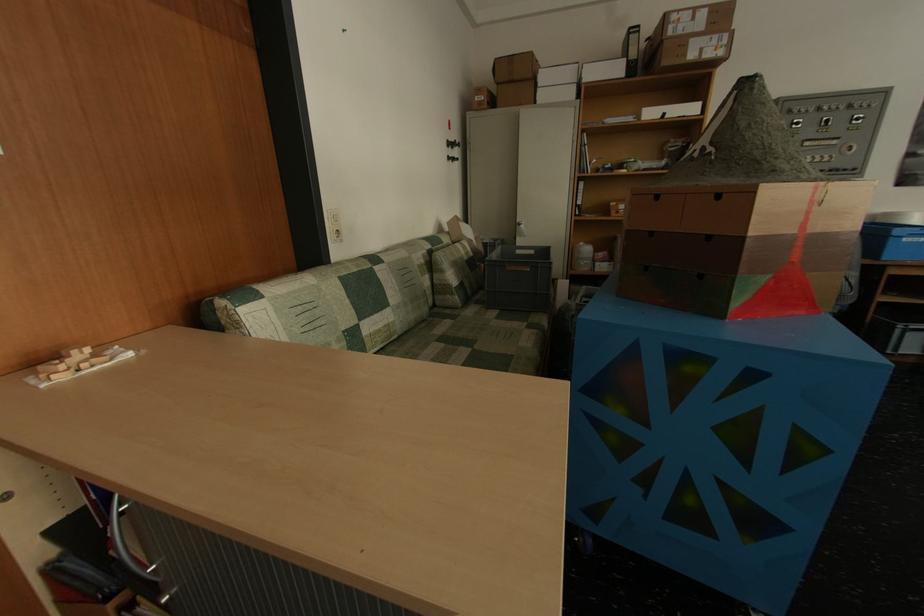
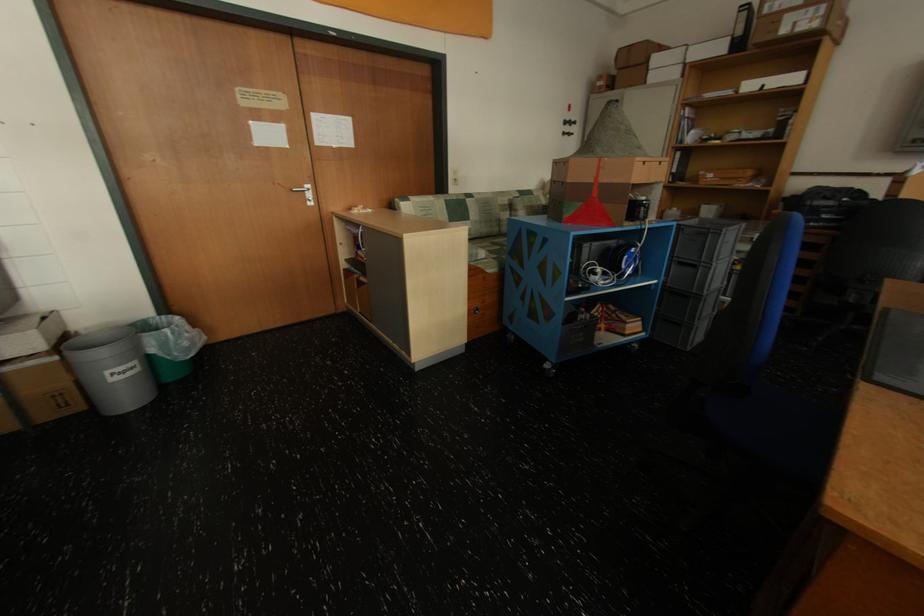
Where in the second image is the point corresponding to pixel 772 281 from the first image?

(589, 206)